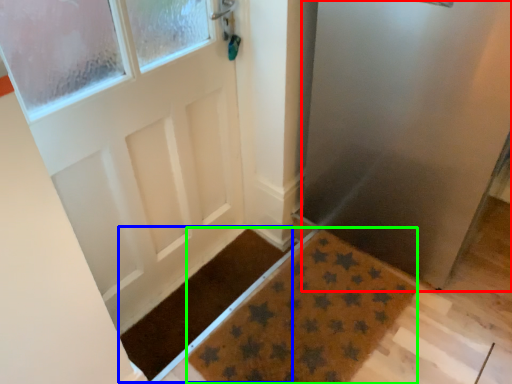
Question: Which object is the closest to the screen door (highlighted by a red box)? Choose among these: doormat (highlighted by a blue box) or doormat (highlighted by a green box).

Choices:
 (A) doormat
 (B) doormat

Answer: (B)